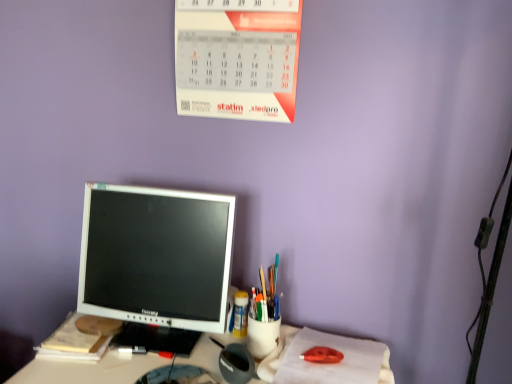
Question: From the image's perspective, is red paper calendar at upper center located above yellow paper notebook at lower left?

Choices:
 (A) no
 (B) yes

Answer: (B)

Question: Is red paper calendar at upper center next to yellow paper notebook at lower left and touching it?

Choices:
 (A) no
 (B) yes

Answer: (A)

Question: Is red paper calendar at upper center further to the viewer compared to yellow paper notebook at lower left?

Choices:
 (A) no
 (B) yes

Answer: (A)

Question: Can you confirm if red paper calendar at upper center is positioned to the right of yellow paper notebook at lower left?

Choices:
 (A) no
 (B) yes

Answer: (B)

Question: Is red paper calendar at upper center bigger than yellow paper notebook at lower left?

Choices:
 (A) no
 (B) yes

Answer: (B)

Question: In the image, is white glossy computer monitor at center positioned in front of or behind yellow paper notebook at lower left?

Choices:
 (A) front
 (B) behind

Answer: (A)

Question: From the image's perspective, relative to yellow paper notebook at lower left, is white glossy computer monitor at center above or below?

Choices:
 (A) above
 (B) below

Answer: (A)

Question: Considering the relative positions of white glossy computer monitor at center and yellow paper notebook at lower left in the image provided, is white glossy computer monitor at center to the left or to the right of yellow paper notebook at lower left?

Choices:
 (A) left
 (B) right

Answer: (B)

Question: From a real-world perspective, is white glossy computer monitor at center positioned above or below yellow paper notebook at lower left?

Choices:
 (A) above
 (B) below

Answer: (A)

Question: From the image's perspective, relative to yellow paper notebook at lower left, is white glossy monitor at center above or below?

Choices:
 (A) above
 (B) below

Answer: (B)

Question: Considering the positions of white glossy monitor at center and yellow paper notebook at lower left in the image, is white glossy monitor at center bigger or smaller than yellow paper notebook at lower left?

Choices:
 (A) small
 (B) big

Answer: (B)

Question: Would you say white glossy monitor at center is to the left or to the right of yellow paper notebook at lower left in the picture?

Choices:
 (A) left
 (B) right

Answer: (B)

Question: From a real-world perspective, is white glossy monitor at center positioned above or below yellow paper notebook at lower left?

Choices:
 (A) above
 (B) below

Answer: (B)

Question: From their relative heights in the image, would you say yellow paper notebook at lower left is taller or shorter than red paper calendar at upper center?

Choices:
 (A) short
 (B) tall

Answer: (A)

Question: Choose the correct answer: Is yellow paper notebook at lower left inside red paper calendar at upper center or outside it?

Choices:
 (A) inside
 (B) outside

Answer: (B)